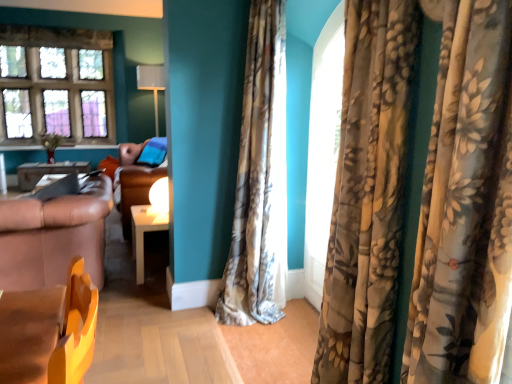
Question: Looking at the image, does floral fabric curtain at right seem bigger or smaller compared to white glossy lampshade at upper center?

Choices:
 (A) small
 (B) big

Answer: (A)

Question: Is point (312, 291) closer or farther from the camera than point (158, 135)?

Choices:
 (A) closer
 (B) farther

Answer: (A)

Question: Based on their relative distances, which object is nearer to the stained glass window at upper left?

Choices:
 (A) brown leather couch at left
 (B) floral fabric curtain at right
 (C) white glossy table at center, which is counted as the second table, starting from the back
 (D) floral silk curtain at center, the 1th curtain positioned from the left
 (E) metallic silver table at left, the second table ordered from the bottom

Answer: (E)

Question: Which of these objects is positioned farthest from the brown leather couch at left?

Choices:
 (A) floral fabric curtain at right
 (B) white glossy table at center, marked as the 2th table in a left-to-right arrangement
 (C) brown leather couch at center
 (D) floral velvet curtains at right, placed as the second curtain when sorted from back to front
 (E) white glossy lampshade at upper center

Answer: (E)